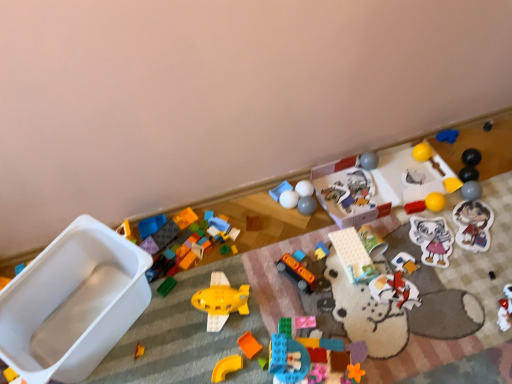
This screenshot has height=384, width=512. What are the coordinates of `vacant space in front of orange matte bus at center, the sixteenth toy in the right-to-left sequence` in the screenshot? It's located at (304, 318).